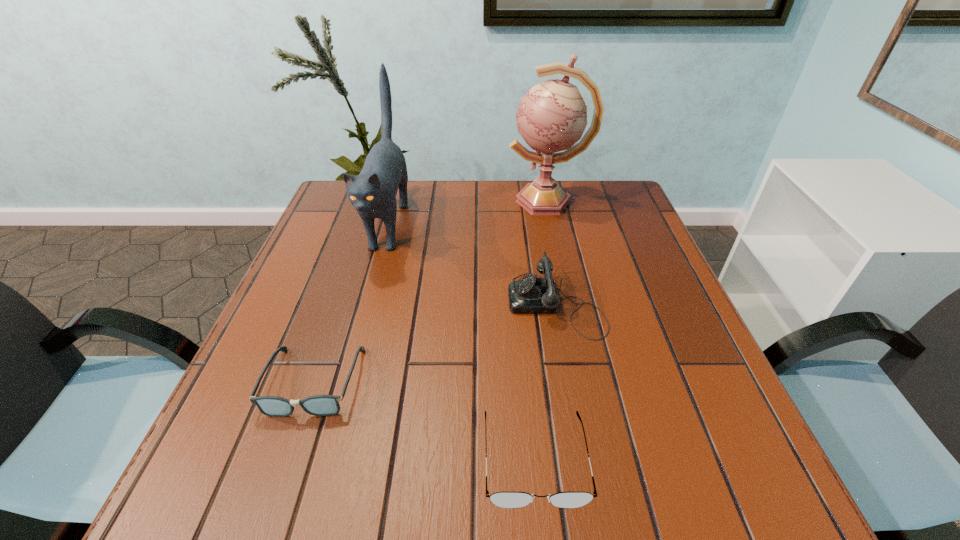
Identify the location of free space located on the front-facing side of the third tallest object. (440, 302).

In order to click on free point located on the front-facing side of the third tallest object in this screenshot , I will do `click(376, 302)`.

Locate an element on the screen. This screenshot has height=540, width=960. globe present at the far edge is located at coordinates (552, 116).

The height and width of the screenshot is (540, 960). Identify the location of cat that is at the far edge. (373, 192).

Locate an element on the screen. object that is at the near edge is located at coordinates (510, 500).

You are a GUI agent. You are given a task and a screenshot of the screen. Output one action in this format:
    pyautogui.click(x=<x>, y=<y>)
    Task: Click on the cat that is positioned at the left edge
    
    Given the screenshot: What is the action you would take?
    pyautogui.click(x=373, y=192)

At what (x,y) coordinates should I click in order to perform the action: click on spectacles that is at the left edge. Please return your answer as a coordinate pair (x, y). The width and height of the screenshot is (960, 540). Looking at the image, I should click on (319, 405).

Identify the location of object located in the right edge section of the desktop. (552, 116).

This screenshot has height=540, width=960. Find the location of `object that is positioned at the far left corner`. object that is positioned at the far left corner is located at coordinates (373, 192).

Image resolution: width=960 pixels, height=540 pixels. I want to click on object positioned at the far right corner, so click(552, 116).